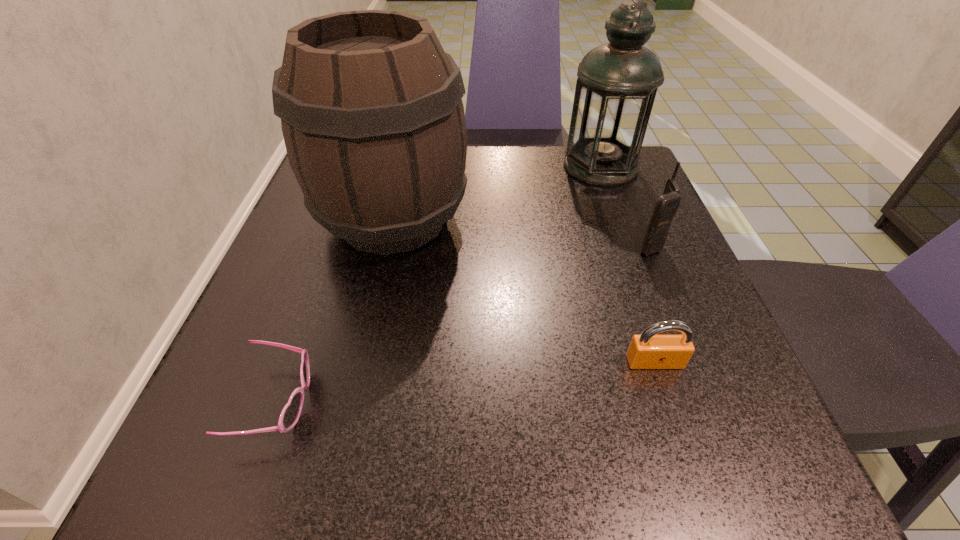
Where is `the tallest object`? This screenshot has height=540, width=960. the tallest object is located at coordinates (617, 82).

I want to click on wine bucket, so click(371, 109).

Locate an element on the screen. The image size is (960, 540). the third tallest object is located at coordinates (666, 206).

In order to click on padlock in this screenshot , I will do `click(646, 351)`.

Identify the location of sunglasses. (290, 414).

Locate an element on the screen. The image size is (960, 540). blank area located on the front of the oil lamp is located at coordinates (648, 298).

The width and height of the screenshot is (960, 540). I want to click on vacant point located on the front of the fourth shortest object, so click(365, 342).

You are a GUI agent. You are given a task and a screenshot of the screen. Output one action in this format:
    pyautogui.click(x=<x>, y=<y>)
    Task: Click on the free space located 0.200m on the keyboard of the cellular telephone
    The image size is (960, 540).
    Given the screenshot: What is the action you would take?
    pyautogui.click(x=530, y=244)

You are a GUI agent. You are given a task and a screenshot of the screen. Output one action in this format:
    pyautogui.click(x=<x>, y=<y>)
    Task: Click on the vacant region located 0.080m on the keyboard of the cellular telephone
    Image resolution: width=960 pixels, height=540 pixels.
    Given the screenshot: What is the action you would take?
    [593, 244]

Image resolution: width=960 pixels, height=540 pixels. Find the location of `free location located on the keyboard of the cellular telephone`. free location located on the keyboard of the cellular telephone is located at coordinates (540, 244).